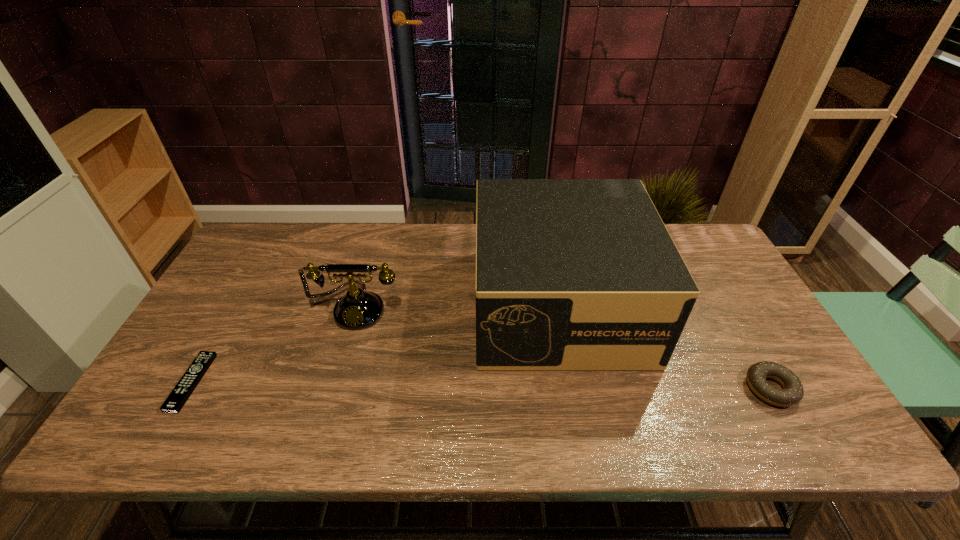
At what (x,y) coordinates should I click in order to perform the action: click on vacant space at the near edge of the desktop. Please return your answer as a coordinate pair (x, y). The height and width of the screenshot is (540, 960). Looking at the image, I should click on (514, 410).

Locate an element on the screen. Image resolution: width=960 pixels, height=540 pixels. vacant space at the far left corner is located at coordinates (275, 225).

Where is `unoccupied area between the box and the second tallest object`? This screenshot has height=540, width=960. unoccupied area between the box and the second tallest object is located at coordinates (458, 306).

Image resolution: width=960 pixels, height=540 pixels. What are the coordinates of `unoccupied position between the second object from right to left and the remote control` in the screenshot? It's located at (375, 343).

Find the location of a particular element. vacant space that is in between the third object from right to left and the second object from right to left is located at coordinates (458, 306).

The image size is (960, 540). I want to click on vacant region between the rightmost object and the leftmost object, so click(481, 385).

This screenshot has width=960, height=540. I want to click on free spot between the second object from right to left and the shortest object, so click(375, 343).

The image size is (960, 540). I want to click on vacant area that lies between the tallest object and the third shortest object, so click(x=458, y=306).

Locate an element on the screen. The height and width of the screenshot is (540, 960). free spot between the box and the shortest object is located at coordinates (375, 343).

This screenshot has height=540, width=960. Find the location of `free space between the telephone and the leftmost object`. free space between the telephone and the leftmost object is located at coordinates (275, 345).